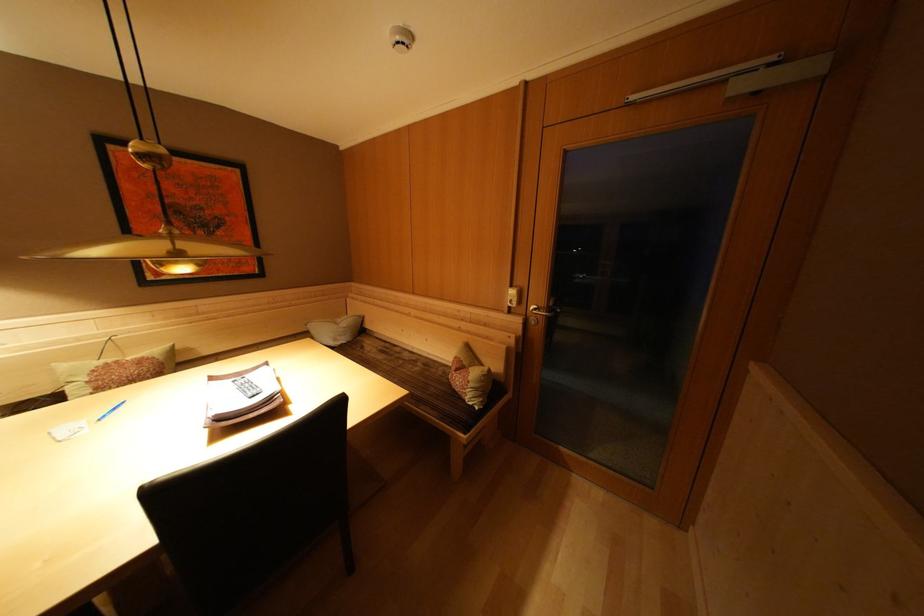
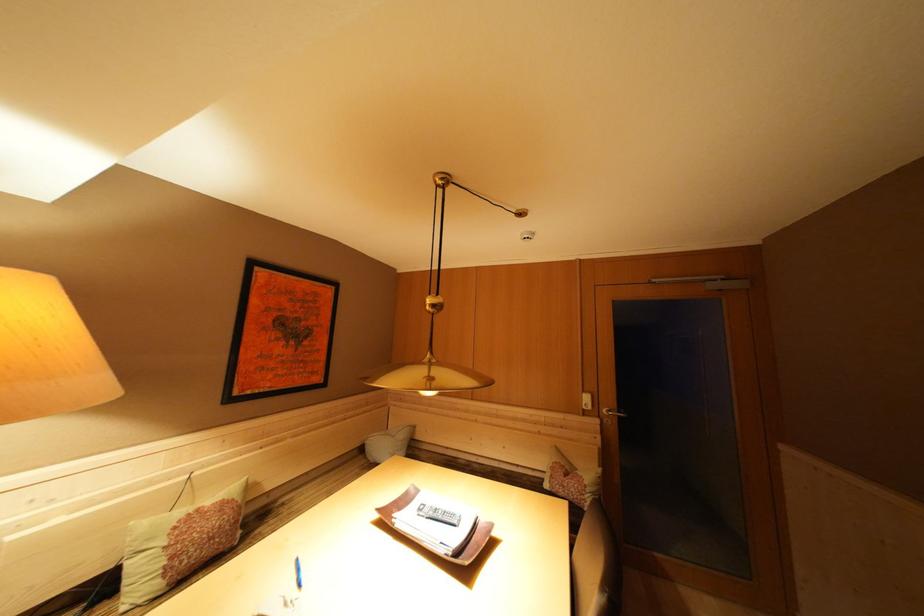
Question: The images are taken continuously from a first-person perspective. In which direction are you moving?

Choices:
 (A) Left
 (B) Right
 (C) Forward
 (D) Backward

Answer: (A)